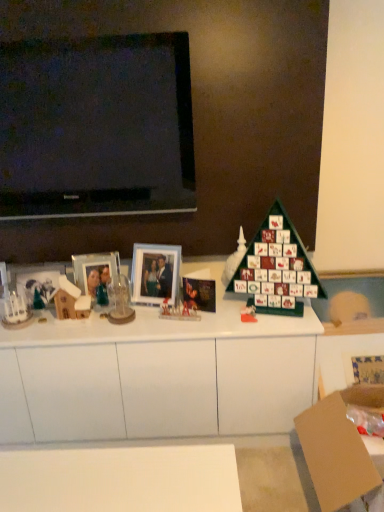
The width and height of the screenshot is (384, 512). What are the coordinates of `vacant area to the left of translucent glass figurine at center, placed as the second toy when sorted from left to right` in the screenshot? It's located at (141, 324).